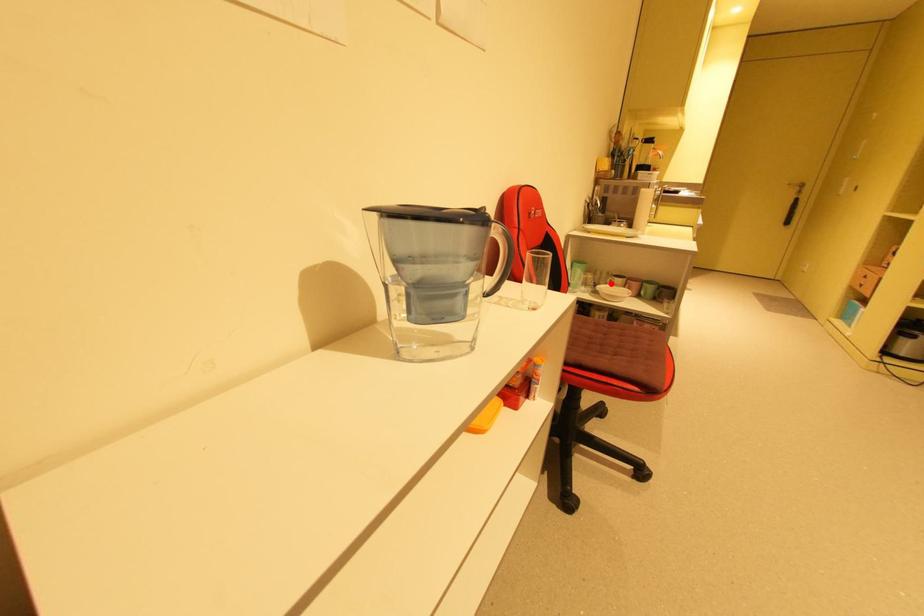
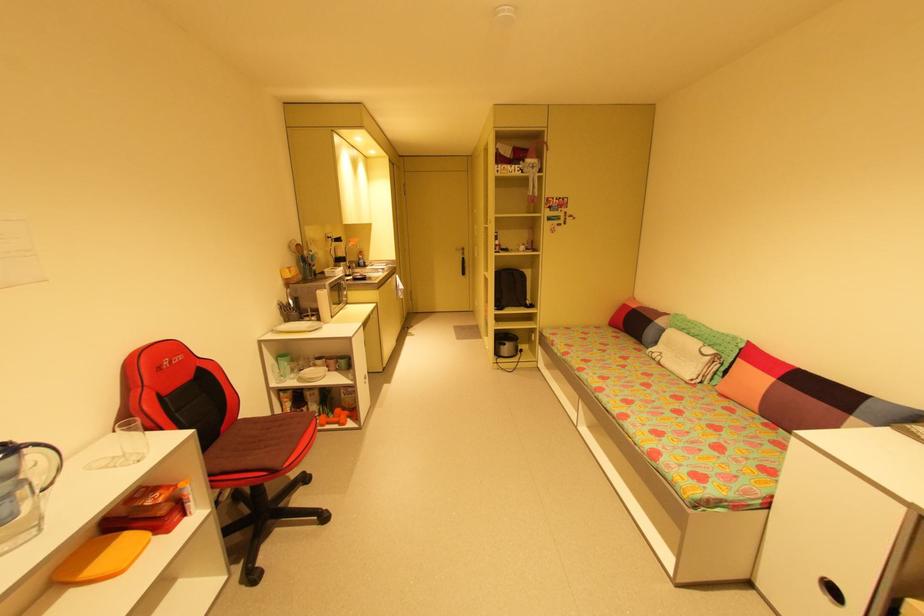
Question: I am providing you with two images of the same scene from different viewpoints. Image1 has a red point marked. In image2, the corresponding 3D location appears at what relative position? Reply with the corresponding letter.

Choices:
 (A) Closer
 (B) Farther

Answer: (B)